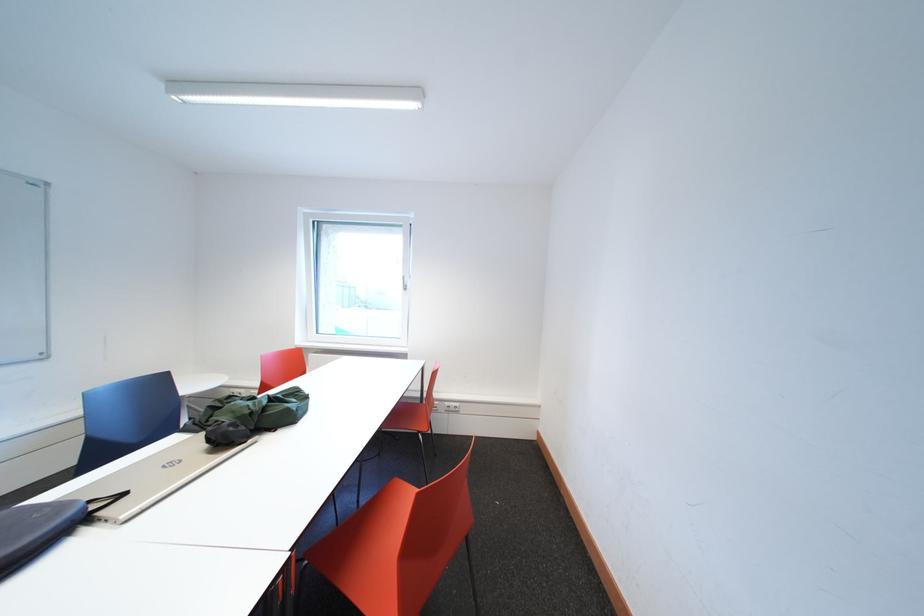
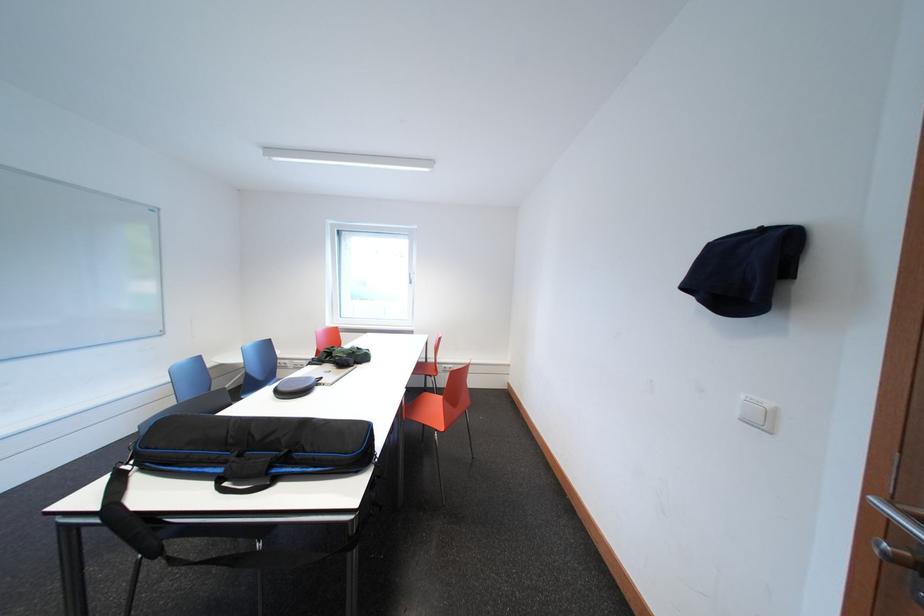
Question: Which direction would the cameraman need to move to produce the second image? Reply with the corresponding letter.

Choices:
 (A) Left
 (B) Right
 (C) Forward
 (D) Backward

Answer: (D)